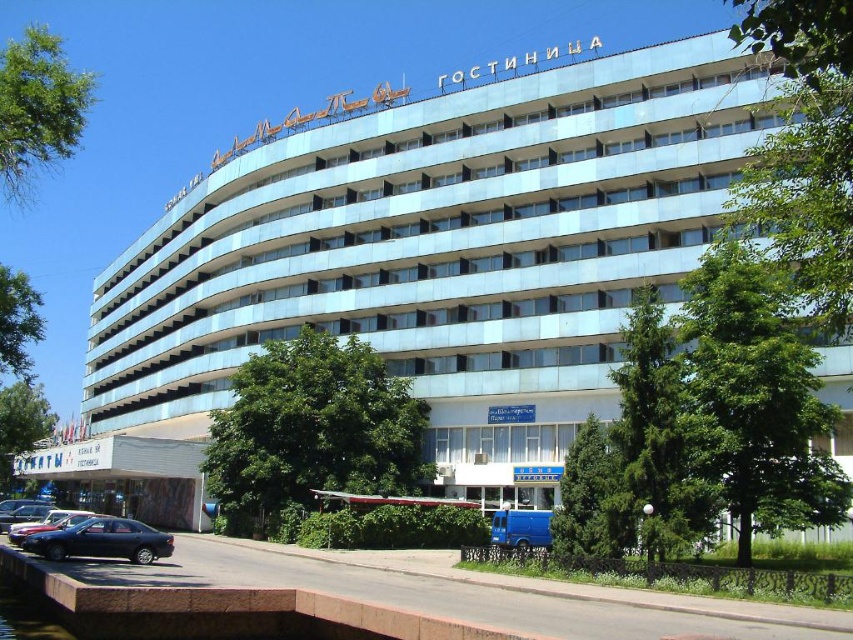
Question: Is matte black sedan at lower left further to camera compared to metallic blue sedan at lower left?

Choices:
 (A) yes
 (B) no

Answer: (B)

Question: Which object is closer to the camera taking this photo?

Choices:
 (A) matte black sedan at lower left
 (B) metallic blue sedan at lower left

Answer: (A)

Question: Which point appears farthest from the camera in this image?

Choices:
 (A) (39, 548)
 (B) (62, 515)

Answer: (B)

Question: Is matte black sedan at lower left below metallic blue sedan at lower left?

Choices:
 (A) yes
 (B) no

Answer: (B)

Question: Is matte black sedan at lower left further to camera compared to metallic blue sedan at lower left?

Choices:
 (A) yes
 (B) no

Answer: (B)

Question: Which point is closer to the camera?

Choices:
 (A) metallic blue sedan at lower left
 (B) matte black sedan at lower left

Answer: (B)